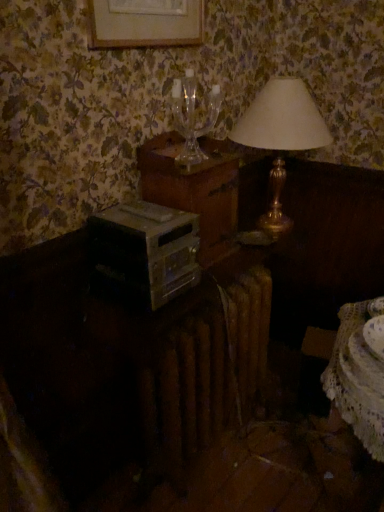
I want to click on vacant space situated above wooden nightstand at center (from a real-world perspective), so click(x=198, y=148).